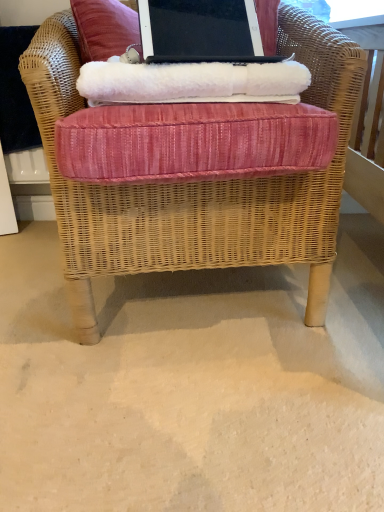
Question: Is woven wicker chair at center not near black matte laptop at upper center?

Choices:
 (A) no
 (B) yes

Answer: (B)

Question: Could you tell me if woven wicker chair at center is facing black matte laptop at upper center?

Choices:
 (A) no
 (B) yes

Answer: (B)

Question: Is woven wicker chair at center at the right side of black matte laptop at upper center?

Choices:
 (A) yes
 (B) no

Answer: (B)

Question: Considering the relative sizes of woven wicker chair at center and black matte laptop at upper center in the image provided, is woven wicker chair at center smaller than black matte laptop at upper center?

Choices:
 (A) yes
 (B) no

Answer: (B)

Question: From the image's perspective, is woven wicker chair at center located beneath black matte laptop at upper center?

Choices:
 (A) no
 (B) yes

Answer: (B)

Question: Relative to black matte laptop at upper center, is woven wicker chair at center in front or behind?

Choices:
 (A) behind
 (B) front

Answer: (B)

Question: Choose the correct answer: Is woven wicker chair at center inside black matte laptop at upper center or outside it?

Choices:
 (A) inside
 (B) outside

Answer: (B)

Question: Based on their sizes in the image, would you say woven wicker chair at center is bigger or smaller than black matte laptop at upper center?

Choices:
 (A) big
 (B) small

Answer: (A)

Question: From a real-world perspective, is woven wicker chair at center positioned above or below black matte laptop at upper center?

Choices:
 (A) below
 (B) above

Answer: (A)

Question: Choose the correct answer: Is white fluffy blanket at upper center inside black matte laptop at upper center or outside it?

Choices:
 (A) outside
 (B) inside

Answer: (A)

Question: Considering the positions of point (175, 68) and point (225, 40), is point (175, 68) closer or farther from the camera than point (225, 40)?

Choices:
 (A) closer
 (B) farther

Answer: (A)

Question: Considering the relative positions of white fluffy blanket at upper center and black matte laptop at upper center in the image provided, is white fluffy blanket at upper center to the left or to the right of black matte laptop at upper center?

Choices:
 (A) right
 (B) left

Answer: (B)

Question: Based on their sizes in the image, would you say white fluffy blanket at upper center is bigger or smaller than black matte laptop at upper center?

Choices:
 (A) small
 (B) big

Answer: (B)

Question: From a real-world perspective, relative to white fluffy blanket at upper center, is woven wicker chair at center vertically above or below?

Choices:
 (A) below
 (B) above

Answer: (A)

Question: Choose the correct answer: Is woven wicker chair at center inside white fluffy blanket at upper center or outside it?

Choices:
 (A) outside
 (B) inside

Answer: (A)